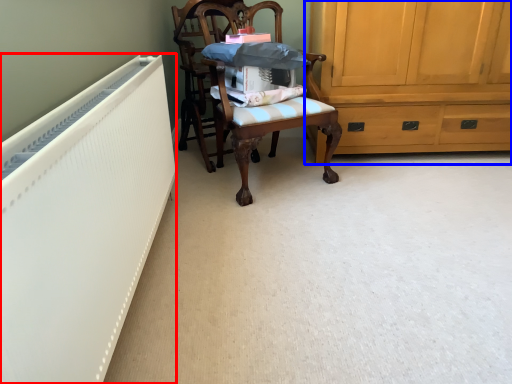
Question: Which point is further to the camera, radiator (highlighted by a red box) or cabinetry (highlighted by a blue box)?

Choices:
 (A) radiator
 (B) cabinetry

Answer: (B)